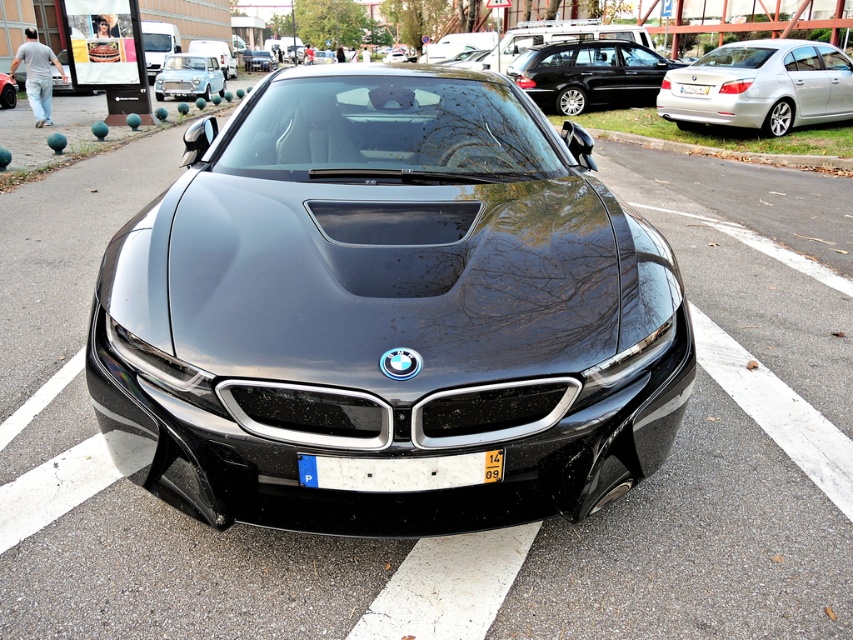
You are a parking attendant and need to verify the license plate of the metallic silver sedan at center. From your position in front of the car, which side should you look to locate the white plastic license plate at center?

The white plastic license plate at center is to the right of the metallic silver sedan at center, so you should look to the right side of the car to locate it.

You are standing in the parking lot looking at the BMW i8. There are two points marked on the car. Which point is closer to you, point (177, 54) or point (263, 54)?

Point (177, 54) is closer to the viewer than point (263, 54).

You are a parking attendant who needs to fit a new car into a parking space. The space is exactly the width of the metallic silver sedan at center. Can the light blue metallic sedan at upper left fit into this space without overlapping the lines?

The light blue metallic sedan at upper left is wider than the metallic silver sedan at center, so it cannot fit into the parking space designed for the metallic silver sedan at center without overlapping the lines.